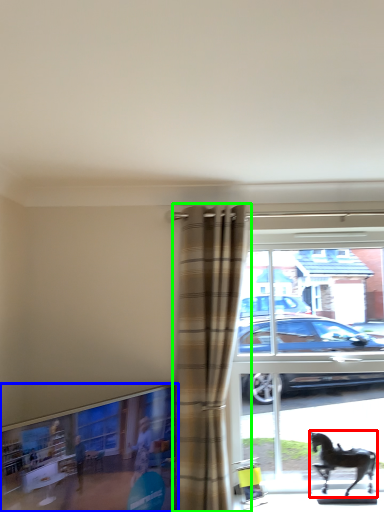
Question: Which object is the farthest from horse (highlighted by a red box)? Choose among these: window frame (highlighted by a blue box) or curtain (highlighted by a green box).

Choices:
 (A) window frame
 (B) curtain

Answer: (A)